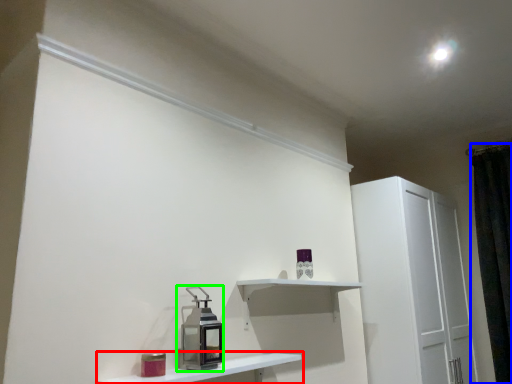
Question: Estimate the real-world distances between objects in this image. Which object is farther from shelf (highlighted by a red box), curtain (highlighted by a blue box) or appliance (highlighted by a green box)?

Choices:
 (A) curtain
 (B) appliance

Answer: (A)